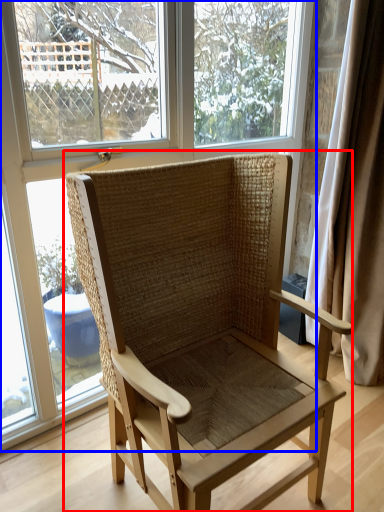
Question: Which object appears closest to the camera in this image, chair (highlighted by a red box) or window (highlighted by a blue box)?

Choices:
 (A) chair
 (B) window

Answer: (A)